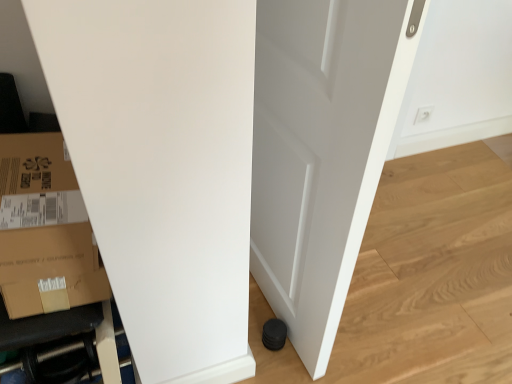
Question: From the image's perspective, is white matte door at center located beneath white plastic electric outlet at upper right?

Choices:
 (A) yes
 (B) no

Answer: (A)

Question: Does white matte door at center come in front of white plastic electric outlet at upper right?

Choices:
 (A) no
 (B) yes

Answer: (B)

Question: Can you confirm if white matte door at center is bigger than white plastic electric outlet at upper right?

Choices:
 (A) yes
 (B) no

Answer: (A)

Question: Is white plastic electric outlet at upper right inside white matte door at center?

Choices:
 (A) yes
 (B) no

Answer: (B)

Question: Is white matte door at center not close to white plastic electric outlet at upper right?

Choices:
 (A) no
 (B) yes

Answer: (B)

Question: In terms of height, does black rubber hose at lower left look taller or shorter compared to white matte door at center?

Choices:
 (A) tall
 (B) short

Answer: (B)

Question: Is point (15, 324) closer or farther from the camera than point (278, 76)?

Choices:
 (A) closer
 (B) farther

Answer: (A)

Question: Is black rubber hose at lower left in front of or behind white matte door at center in the image?

Choices:
 (A) front
 (B) behind

Answer: (B)

Question: Based on their sizes in the image, would you say black rubber hose at lower left is bigger or smaller than white matte door at center?

Choices:
 (A) small
 (B) big

Answer: (A)

Question: Is black rubber hose at lower left to the left or to the right of white plastic electric outlet at upper right in the image?

Choices:
 (A) right
 (B) left

Answer: (B)

Question: Considering the positions of black rubber hose at lower left and white plastic electric outlet at upper right in the image, is black rubber hose at lower left wider or thinner than white plastic electric outlet at upper right?

Choices:
 (A) thin
 (B) wide

Answer: (B)

Question: From the image's perspective, is black rubber hose at lower left above or below white plastic electric outlet at upper right?

Choices:
 (A) below
 (B) above

Answer: (A)

Question: Would you say black rubber hose at lower left is inside or outside white plastic electric outlet at upper right?

Choices:
 (A) outside
 (B) inside

Answer: (A)

Question: Is point (316, 253) positioned closer to the camera than point (35, 362)?

Choices:
 (A) farther
 (B) closer

Answer: (B)

Question: From the image's perspective, is white matte door at center located above or below black rubber hose at lower left?

Choices:
 (A) below
 (B) above

Answer: (B)